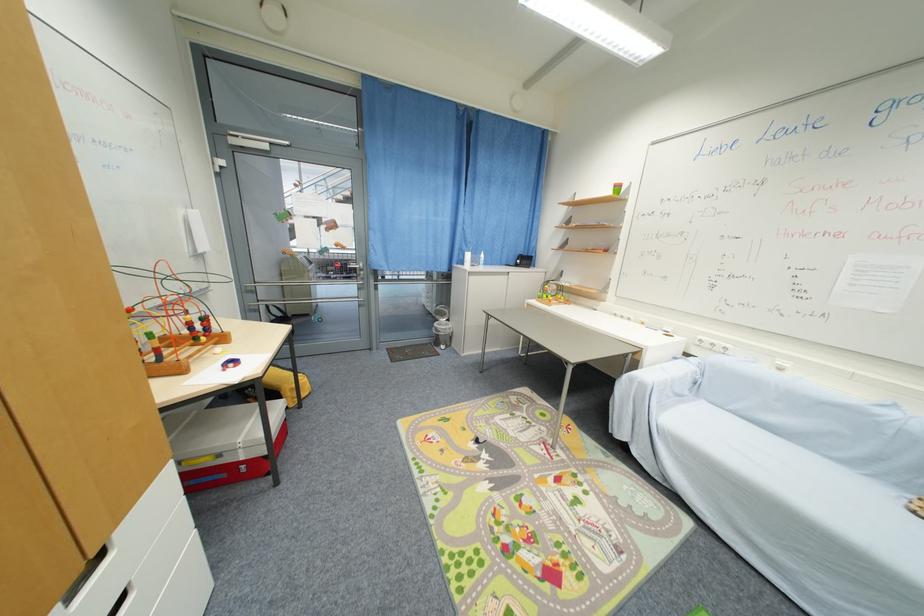
What do you see at coordinates (359, 268) in the screenshot? I see `the metal door handle` at bounding box center [359, 268].